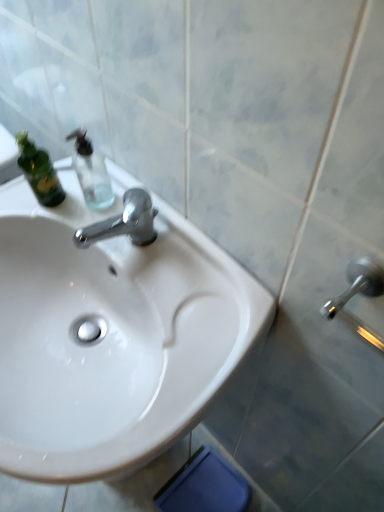
Question: Does point (107, 390) appear closer or farther from the camera than point (82, 137)?

Choices:
 (A) farther
 (B) closer

Answer: (B)

Question: From the image's perspective, relative to transparent glass soap dispenser at upper left, is white glossy sink at center above or below?

Choices:
 (A) above
 (B) below

Answer: (B)

Question: In terms of width, does white glossy sink at center look wider or thinner when compared to transparent glass soap dispenser at upper left?

Choices:
 (A) wide
 (B) thin

Answer: (A)

Question: Is transparent glass soap dispenser at upper left in front of or behind white glossy sink at center in the image?

Choices:
 (A) front
 (B) behind

Answer: (B)

Question: Is transparent glass soap dispenser at upper left taller or shorter than white glossy sink at center?

Choices:
 (A) tall
 (B) short

Answer: (B)

Question: Considering the positions of transparent glass soap dispenser at upper left and white glossy sink at center in the image, is transparent glass soap dispenser at upper left wider or thinner than white glossy sink at center?

Choices:
 (A) wide
 (B) thin

Answer: (B)

Question: From a real-world perspective, is transparent glass soap dispenser at upper left positioned above or below white glossy sink at center?

Choices:
 (A) above
 (B) below

Answer: (A)